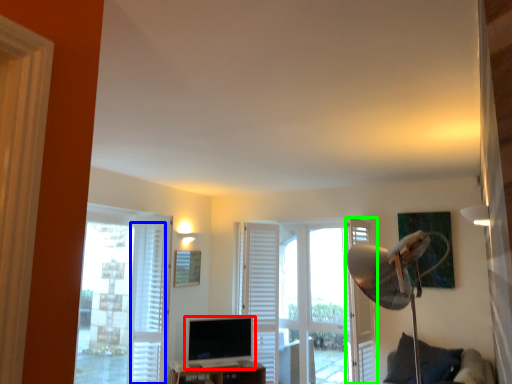
Question: Which object is positioned farthest from computer monitor (highlighted by a red box)? Select from curtain (highlighted by a blue box) and screen door (highlighted by a green box).

Choices:
 (A) curtain
 (B) screen door

Answer: (B)